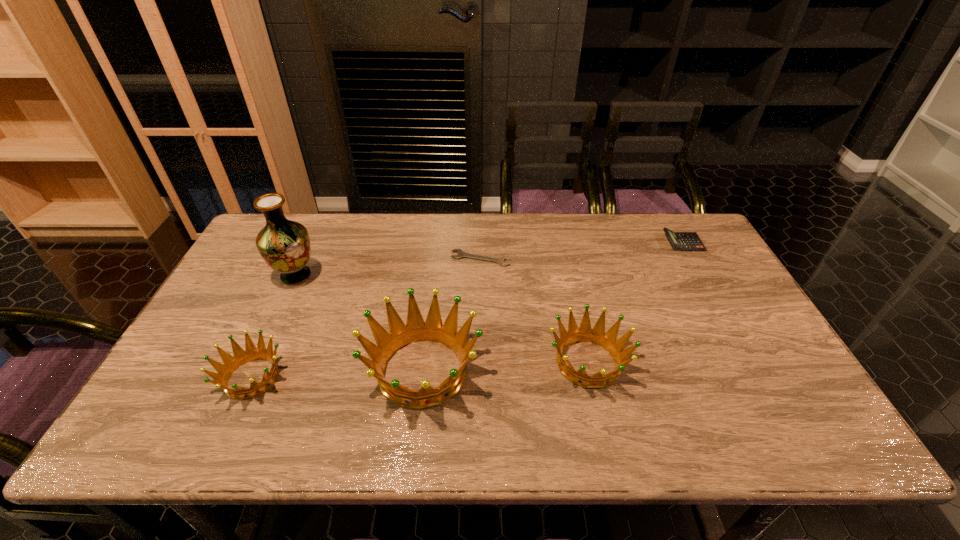
This screenshot has width=960, height=540. What are the coordinates of `vacant area situated on the right of the leftmost crown` in the screenshot? It's located at (372, 377).

Where is `vacant space situated on the right of the second crown from left to right`? The width and height of the screenshot is (960, 540). vacant space situated on the right of the second crown from left to right is located at coordinates (636, 370).

You are a GUI agent. You are given a task and a screenshot of the screen. Output one action in this format:
    pyautogui.click(x=<x>, y=<y>)
    Task: Click on the free location located on the left of the second shortest crown
    This screenshot has width=960, height=540.
    Given the screenshot: What is the action you would take?
    pyautogui.click(x=468, y=362)

Where is `free space located on the back of the shortest object`? free space located on the back of the shortest object is located at coordinates (480, 228).

At what (x,y) coordinates should I click in order to perform the action: click on free space located on the front of the second shortest object. Please return your answer as a coordinate pair (x, y). Image resolution: width=960 pixels, height=540 pixels. Looking at the image, I should click on (723, 314).

This screenshot has width=960, height=540. I want to click on vacant area situated on the right of the tallest object, so click(x=391, y=276).

Where is `wrench situated at the far edge`? wrench situated at the far edge is located at coordinates (461, 254).

Locate an element on the screen. calculator at the far edge is located at coordinates (685, 241).

This screenshot has width=960, height=540. Find the location of `crown present at the left edge`. crown present at the left edge is located at coordinates (251, 353).

Locate an element on the screen. This screenshot has width=960, height=540. vase that is at the left edge is located at coordinates (284, 245).